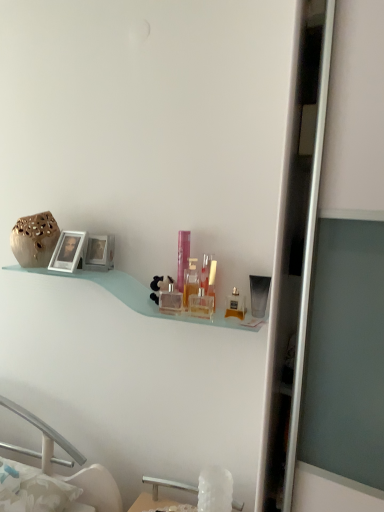
Question: In which direction should I rotate to look at clear glass perfume bottle at center, the eighth toiletry in the right-to-left sequence?

Choices:
 (A) right
 (B) left

Answer: (B)

Question: Are satin black tube at upper right, which ranks as the first toiletry in right-to-left order, and matte gold perfume at center, which appears as the 2th toiletry when viewed from the right, making contact?

Choices:
 (A) yes
 (B) no

Answer: (A)

Question: Is satin black tube at upper right, which ranks as the first toiletry in right-to-left order, bigger than matte gold perfume at center, which appears as the 2th toiletry when viewed from the right?

Choices:
 (A) yes
 (B) no

Answer: (A)

Question: Does satin black tube at upper right, arranged as the eighth toiletry when viewed from the left, appear on the right side of matte gold perfume at center, which appears as the 2th toiletry when viewed from the right?

Choices:
 (A) no
 (B) yes

Answer: (B)

Question: Can you confirm if satin black tube at upper right, which ranks as the first toiletry in right-to-left order, is positioned to the left of matte gold perfume at center, placed as the 7th toiletry when sorted from left to right?

Choices:
 (A) no
 (B) yes

Answer: (A)

Question: Is satin black tube at upper right, arranged as the eighth toiletry when viewed from the left, closer to the viewer compared to matte gold perfume at center, which appears as the 2th toiletry when viewed from the right?

Choices:
 (A) yes
 (B) no

Answer: (B)

Question: Does satin black tube at upper right, arranged as the eighth toiletry when viewed from the left, come behind matte gold perfume at center, which appears as the 2th toiletry when viewed from the right?

Choices:
 (A) no
 (B) yes

Answer: (B)

Question: From a real-world perspective, is silver metallic picture frame at left, acting as the first picture frame starting from the left, under satin black tube at upper right, which ranks as the first toiletry in right-to-left order?

Choices:
 (A) no
 (B) yes

Answer: (A)

Question: Can you confirm if silver metallic picture frame at left, which is the second picture frame from right to left, is bigger than satin black tube at upper right, arranged as the eighth toiletry when viewed from the left?

Choices:
 (A) yes
 (B) no

Answer: (A)

Question: Can you confirm if silver metallic picture frame at left, acting as the first picture frame starting from the left, is shorter than satin black tube at upper right, arranged as the eighth toiletry when viewed from the left?

Choices:
 (A) yes
 (B) no

Answer: (B)

Question: From the image's perspective, is silver metallic picture frame at left, acting as the first picture frame starting from the left, over satin black tube at upper right, arranged as the eighth toiletry when viewed from the left?

Choices:
 (A) yes
 (B) no

Answer: (A)

Question: Is the position of silver metallic picture frame at left, which is the second picture frame from right to left, more distant than that of satin black tube at upper right, which ranks as the first toiletry in right-to-left order?

Choices:
 (A) yes
 (B) no

Answer: (A)

Question: Does silver metallic picture frame at left, acting as the first picture frame starting from the left, appear on the left side of satin black tube at upper right, arranged as the eighth toiletry when viewed from the left?

Choices:
 (A) yes
 (B) no

Answer: (A)

Question: Is clear plastic bottle at center, the 4th toiletry when ordered from right to left, looking in the opposite direction of matte gold perfume at center, placed as the 7th toiletry when sorted from left to right?

Choices:
 (A) yes
 (B) no

Answer: (B)